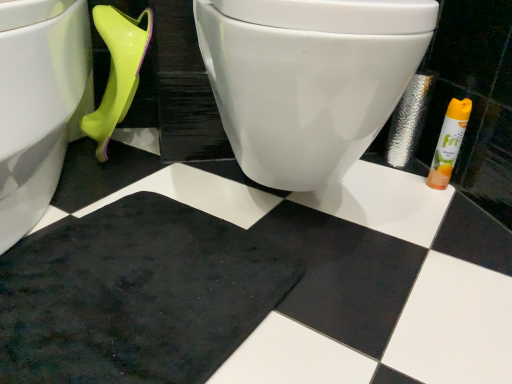
Question: Would you say orange matte air freshener at right is outside white glossy toilet at lower left, which is the 1th toilet in left-to-right order?

Choices:
 (A) no
 (B) yes

Answer: (B)

Question: From the image's perspective, does orange matte air freshener at right appear lower than white glossy toilet at lower left, which is the 1th toilet in left-to-right order?

Choices:
 (A) yes
 (B) no

Answer: (A)

Question: Does orange matte air freshener at right have a larger size compared to white glossy toilet at lower left, which is the 1th toilet in left-to-right order?

Choices:
 (A) no
 (B) yes

Answer: (A)

Question: Is orange matte air freshener at right wider than white glossy toilet at lower left, which is the 1th toilet in left-to-right order?

Choices:
 (A) no
 (B) yes

Answer: (A)

Question: From a real-world perspective, is orange matte air freshener at right below white glossy toilet at lower left, which is the 1th toilet in left-to-right order?

Choices:
 (A) yes
 (B) no

Answer: (A)

Question: From a real-world perspective, is orange matte air freshener at right above or below white glossy toilet at center, which is the 2th toilet from left to right?

Choices:
 (A) below
 (B) above

Answer: (A)

Question: Considering their positions, is orange matte air freshener at right located in front of or behind white glossy toilet at center, which is the 2th toilet from left to right?

Choices:
 (A) behind
 (B) front

Answer: (A)

Question: Is orange matte air freshener at right bigger or smaller than white glossy toilet at center, which is counted as the 1th toilet, starting from the right?

Choices:
 (A) small
 (B) big

Answer: (A)

Question: Is orange matte air freshener at right inside or outside of white glossy toilet at center, which is the 2th toilet from left to right?

Choices:
 (A) outside
 (B) inside

Answer: (A)

Question: Is orange matte air freshener at right taller or shorter than white glossy toilet at lower left, which is the 1th toilet in left-to-right order?

Choices:
 (A) short
 (B) tall

Answer: (A)

Question: Does point (446, 107) appear closer or farther from the camera than point (64, 69)?

Choices:
 (A) closer
 (B) farther

Answer: (B)

Question: From the image's perspective, relative to white glossy toilet at lower left, which is the 1th toilet in left-to-right order, is orange matte air freshener at right above or below?

Choices:
 (A) above
 (B) below

Answer: (B)

Question: From a real-world perspective, is orange matte air freshener at right above or below white glossy toilet at lower left, the second toilet in the right-to-left sequence?

Choices:
 (A) below
 (B) above

Answer: (A)

Question: In the image, is white glossy toilet at lower left, which is the 1th toilet in left-to-right order, positioned in front of or behind white glossy toilet at center, which is counted as the 1th toilet, starting from the right?

Choices:
 (A) behind
 (B) front

Answer: (B)

Question: Considering the positions of point (59, 100) and point (390, 28), is point (59, 100) closer or farther from the camera than point (390, 28)?

Choices:
 (A) closer
 (B) farther

Answer: (B)